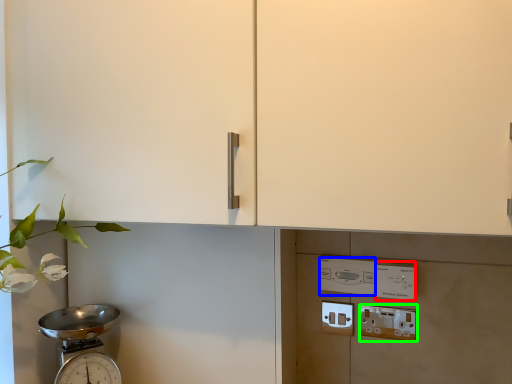
Question: Based on their relative distances, which object is farther from light switch (highlighted by a red box)? Choose from light switch (highlighted by a blue box) and electric outlet (highlighted by a green box).

Choices:
 (A) light switch
 (B) electric outlet

Answer: (B)